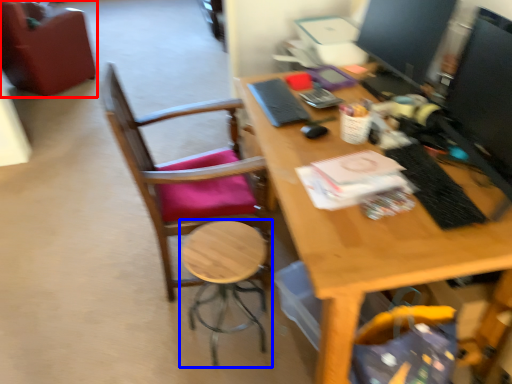
Question: Which of the following is the closest to the observer, chair (highlighted by a red box) or stool (highlighted by a blue box)?

Choices:
 (A) chair
 (B) stool

Answer: (B)